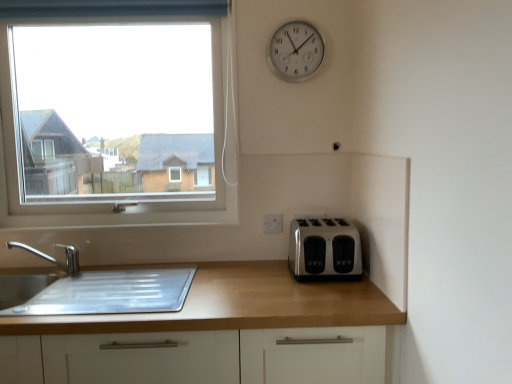
Question: Is satin silver toaster at lower right located within clear glass window at upper left?

Choices:
 (A) no
 (B) yes

Answer: (A)

Question: Does clear glass window at upper left appear on the right side of satin silver toaster at lower right?

Choices:
 (A) yes
 (B) no

Answer: (B)

Question: Does clear glass window at upper left have a lesser width compared to satin silver toaster at lower right?

Choices:
 (A) yes
 (B) no

Answer: (A)

Question: Is clear glass window at upper left directly adjacent to satin silver toaster at lower right?

Choices:
 (A) yes
 (B) no

Answer: (B)

Question: From a real-world perspective, does clear glass window at upper left stand above satin silver toaster at lower right?

Choices:
 (A) yes
 (B) no

Answer: (A)

Question: Does point (270, 64) appear closer or farther from the camera than point (333, 223)?

Choices:
 (A) farther
 (B) closer

Answer: (A)

Question: In terms of size, does silver metallic clock at upper right appear bigger or smaller than satin silver toaster at lower right?

Choices:
 (A) big
 (B) small

Answer: (B)

Question: From the image's perspective, is silver metallic clock at upper right positioned above or below satin silver toaster at lower right?

Choices:
 (A) above
 (B) below

Answer: (A)

Question: Is silver metallic clock at upper right taller or shorter than satin silver toaster at lower right?

Choices:
 (A) tall
 (B) short

Answer: (A)

Question: Visually, is wooden at right positioned to the left or to the right of satin silver toaster at lower right?

Choices:
 (A) right
 (B) left

Answer: (B)

Question: From a real-world perspective, relative to satin silver toaster at lower right, is wooden at right vertically above or below?

Choices:
 (A) below
 (B) above

Answer: (A)

Question: In the image, is wooden at right positioned in front of or behind satin silver toaster at lower right?

Choices:
 (A) behind
 (B) front

Answer: (B)

Question: In terms of height, does wooden at right look taller or shorter compared to satin silver toaster at lower right?

Choices:
 (A) tall
 (B) short

Answer: (A)

Question: Considering the positions of white plastic electric outlet at center and silver metallic faucet at lower left in the image, is white plastic electric outlet at center taller or shorter than silver metallic faucet at lower left?

Choices:
 (A) tall
 (B) short

Answer: (B)

Question: From the image's perspective, is white plastic electric outlet at center positioned above or below silver metallic faucet at lower left?

Choices:
 (A) below
 (B) above

Answer: (B)